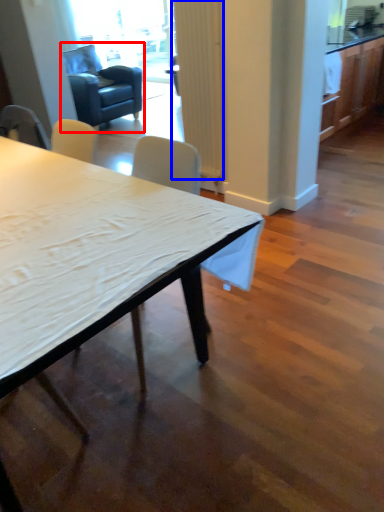
Question: Which object is further to the camera taking this photo, swivel chair (highlighted by a red box) or curtain (highlighted by a blue box)?

Choices:
 (A) swivel chair
 (B) curtain

Answer: (A)